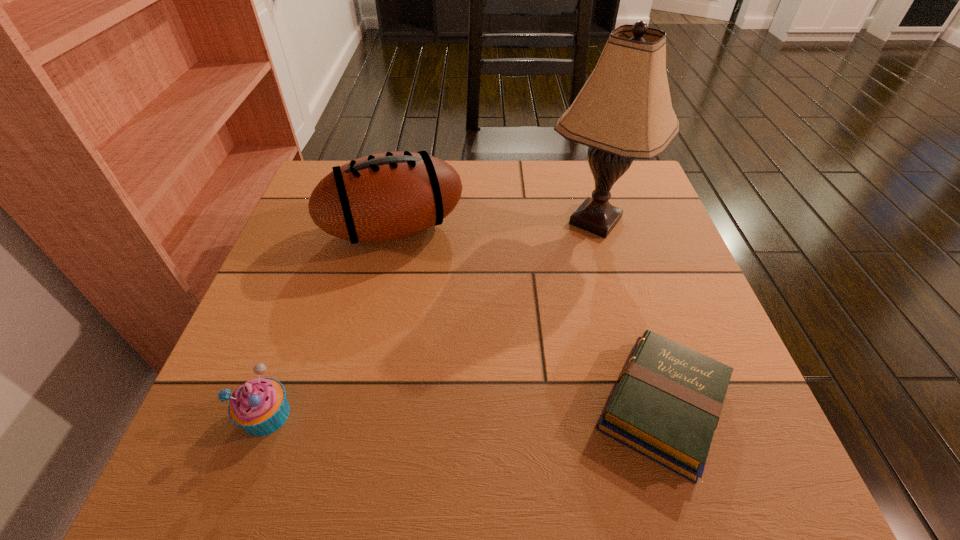
The image size is (960, 540). In order to click on the tallest object in this screenshot , I will do `click(624, 111)`.

Locate an element on the screen. This screenshot has width=960, height=540. football (American) is located at coordinates (387, 196).

Where is `the third tallest object`? The height and width of the screenshot is (540, 960). the third tallest object is located at coordinates (259, 406).

Find the location of a particular element. book is located at coordinates (667, 401).

Image resolution: width=960 pixels, height=540 pixels. In order to click on vacant position located 0.350m on the left of the lamp in this screenshot , I will do `click(403, 221)`.

This screenshot has height=540, width=960. Identify the location of free space located on the front of the football (American). pos(382,286).

Locate an element on the screen. Image resolution: width=960 pixels, height=540 pixels. free space located on the right of the second shortest object is located at coordinates (486, 415).

You are a GUI agent. You are given a task and a screenshot of the screen. Output one action in this format:
    pyautogui.click(x=<x>, y=<y>)
    Task: Click on the free space located 0.290m on the back of the book
    This screenshot has height=540, width=960.
    Given the screenshot: What is the action you would take?
    pyautogui.click(x=612, y=244)

This screenshot has height=540, width=960. I want to click on lamp at the far edge, so click(624, 111).

Find the location of a particular element. football (American) at the far edge is located at coordinates (387, 196).